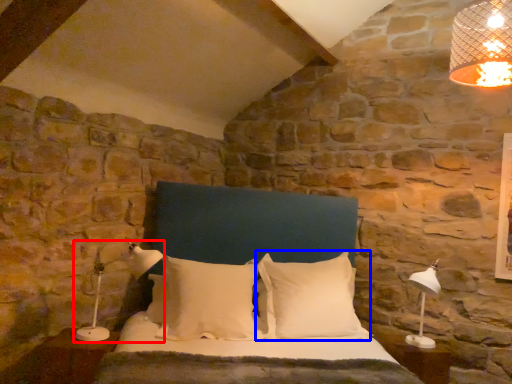
Question: Among these objects, which one is nearest to the camera, lamp (highlighted by a red box) or pillow (highlighted by a blue box)?

Choices:
 (A) lamp
 (B) pillow

Answer: (A)